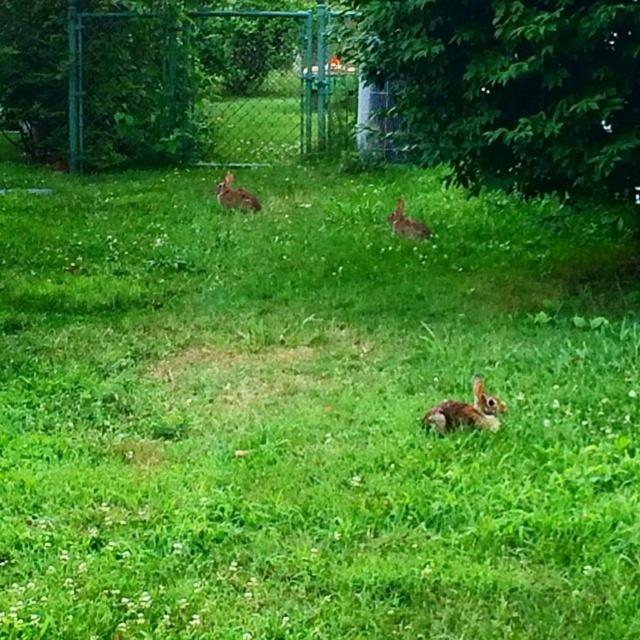
You are standing in the grassy area and see the brown furry rabbit at lower center and the brown furry rabbit at center. Which rabbit is nearer to you?

The brown furry rabbit at lower center is closer to the viewer than the brown furry rabbit at center.